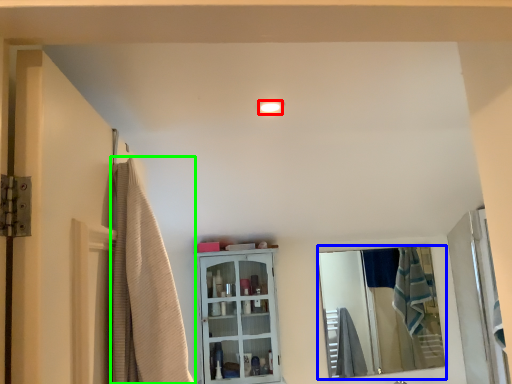
Question: Which object is the farthest from light fixture (highlighted by a red box)? Choose among these: mirror (highlighted by a blue box) or shower curtain (highlighted by a green box).

Choices:
 (A) mirror
 (B) shower curtain

Answer: (A)